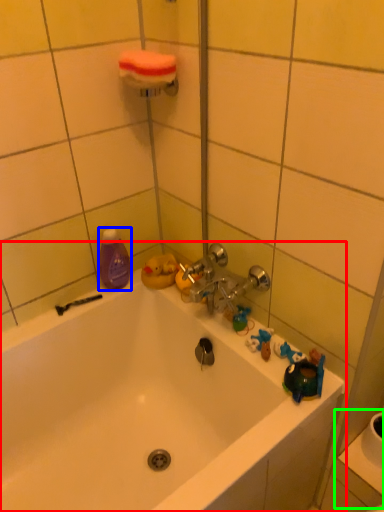
Question: Based on their relative distances, which object is nearer to bathtub (highlighted by a red box)? Choose from cleaning product (highlighted by a blue box) and sink (highlighted by a green box).

Choices:
 (A) cleaning product
 (B) sink

Answer: (A)